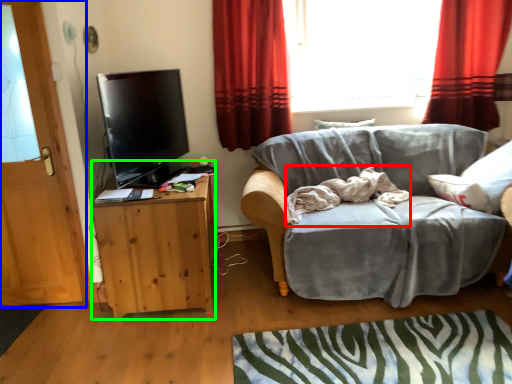
Question: Considering the real-world distances, which object is closest to bedding (highlighted by a red box)? door (highlighted by a blue box) or cabinetry (highlighted by a green box).

Choices:
 (A) door
 (B) cabinetry

Answer: (B)